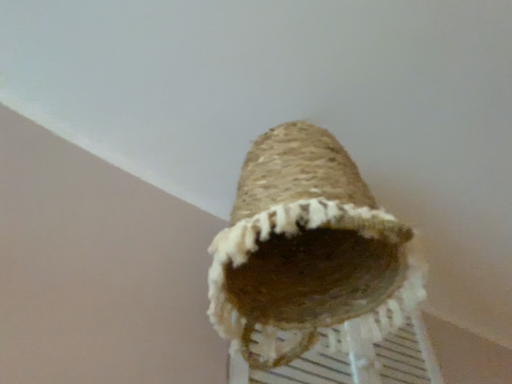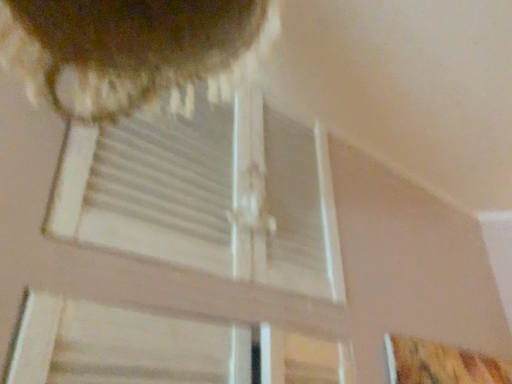
Question: How did the camera likely rotate when shooting the video?

Choices:
 (A) rotated upward
 (B) rotated downward

Answer: (B)